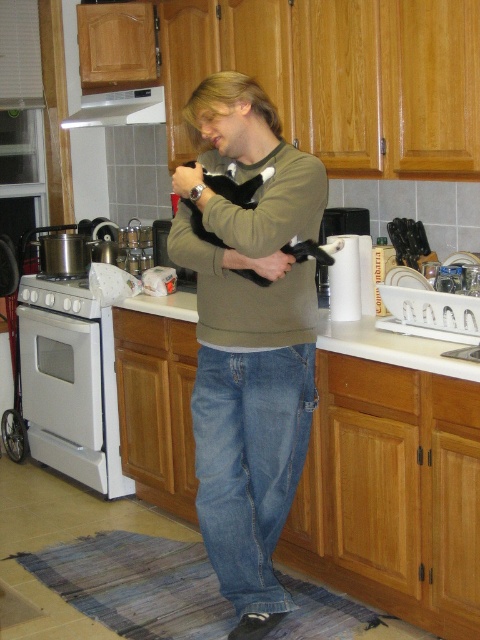
Question: Which object is the closest to the white glossy counter top at center?

Choices:
 (A) soft green sweater at center
 (B) satin silver exhaust hood at upper center
 (C) black fur cat at center
 (D) white glossy oven at lower left

Answer: (A)

Question: Does satin silver exhaust hood at upper center have a lesser width compared to white ceramic sink at center?

Choices:
 (A) yes
 (B) no

Answer: (B)

Question: Is soft green sweater at center wider than black fur cat at center?

Choices:
 (A) yes
 (B) no

Answer: (A)

Question: Is black fur cat at center above satin silver exhaust hood at upper center?

Choices:
 (A) yes
 (B) no

Answer: (B)

Question: Among these points, which one is farthest from the camera?

Choices:
 (A) (429, 355)
 (B) (252, 364)
 (C) (99, 104)
 (D) (248, 268)

Answer: (C)

Question: Among these points, which one is nearest to the camera?

Choices:
 (A) (317, 173)
 (B) (296, 253)
 (C) (358, 355)
 (D) (82, 96)

Answer: (A)